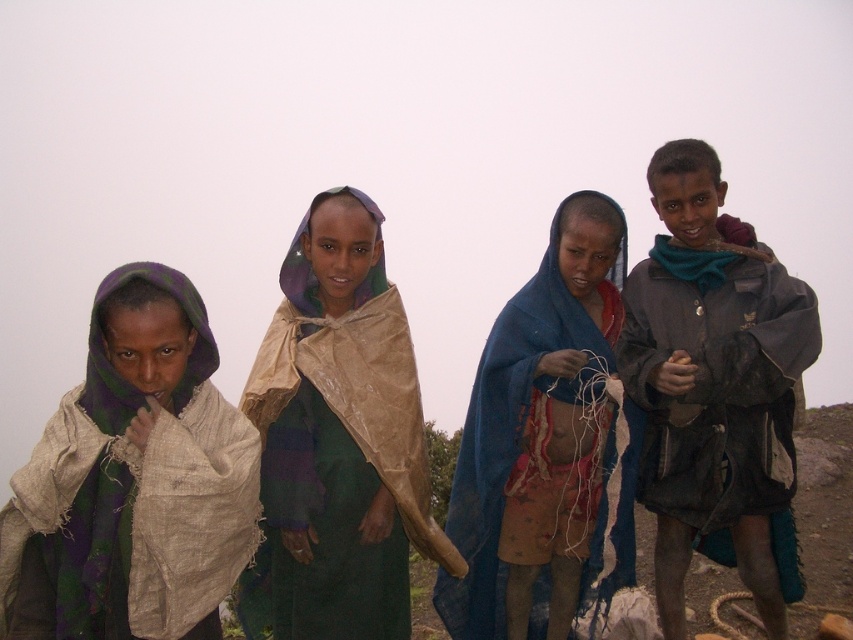
You are a photographer setting up a shoot in a studio. You have two props available for the background setup. The blue sheer cloth at center and the beige fabric scarf at left. You need to arrange them so that the taller prop is placed behind the shorter one. Which prop should be placed behind the other?

The blue sheer cloth at center is taller than the beige fabric scarf at left, so the blue sheer cloth at center should be placed behind the beige fabric scarf at left to follow the requirement.

In the scene shown: Please look at the scene and find the point at coordinate (715, 388). Which object does this point belong to?

The point at coordinate (715, 388) belongs to the dark gray jacket at right.